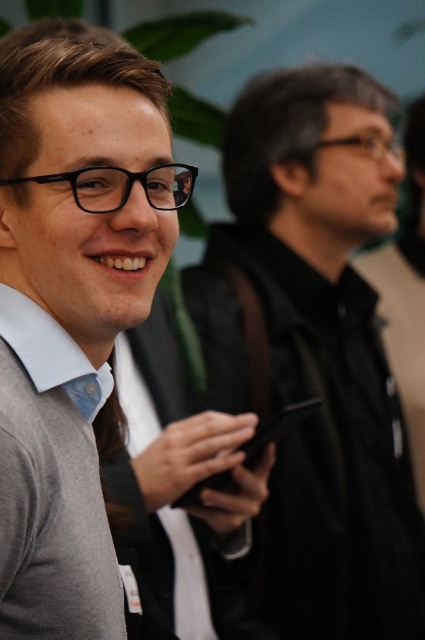
Is point (292, 301) closer to camera compared to point (130, 166)?

No, (292, 301) is further to viewer.

Does black matte jacket at center have a larger size compared to gray sweater at left?

Yes.

Between point (334, 324) and point (23, 490), which one is positioned in front?

Point (23, 490) is more forward.

The image size is (425, 640). In order to click on black matte jacket at center in this screenshot , I will do `click(314, 349)`.

Does gray sweater at left appear on the right side of black matte smartphone at center?

No, gray sweater at left is not to the right of black matte smartphone at center.

Can you confirm if gray sweater at left is shorter than black matte smartphone at center?

No.

The image size is (425, 640). I want to click on gray sweater at left, so click(68, 394).

Does black matte jacket at center appear over black matte smartphone at center?

Yes.

Who is higher up, black matte jacket at center or black matte smartphone at center?

Positioned higher is black matte jacket at center.

Who is more forward, (x=235, y=342) or (x=269, y=428)?

Point (x=269, y=428) is more forward.

Where is `black matte jacket at center`? Image resolution: width=425 pixels, height=640 pixels. black matte jacket at center is located at coordinates (314, 349).